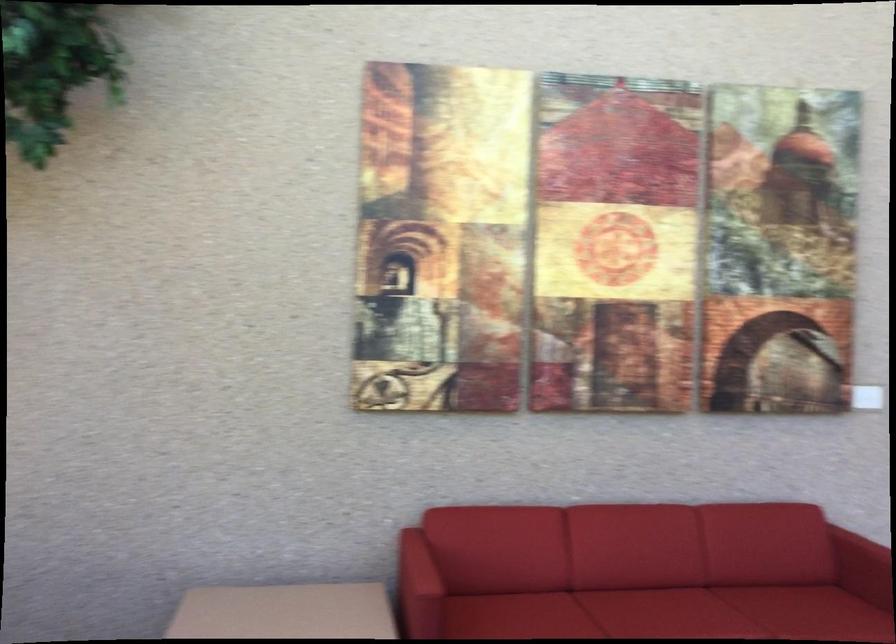
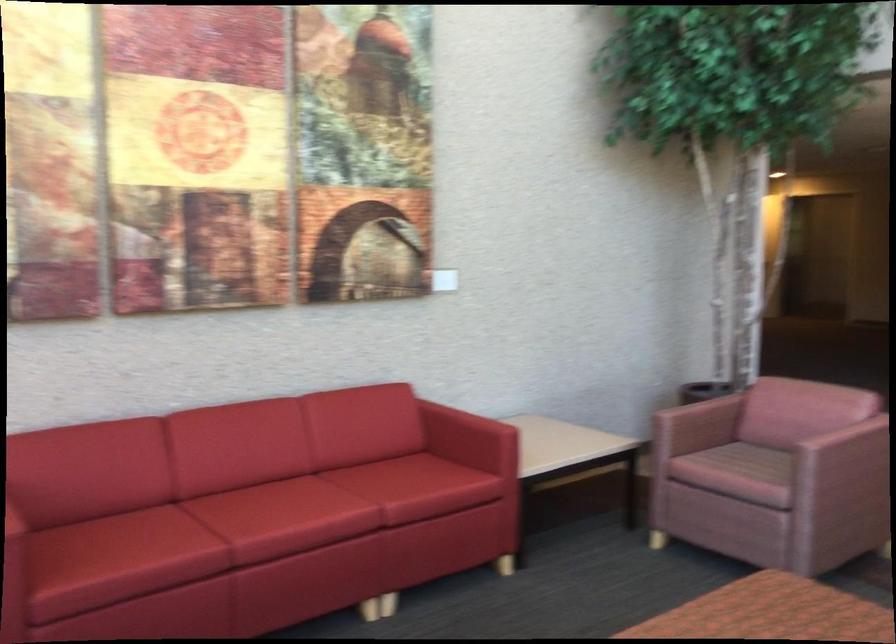
Question: Based on the continuous images, in which direction is the camera rotating? Reply with the corresponding letter.

Choices:
 (A) Left
 (B) Right
 (C) Up
 (D) Down

Answer: (B)